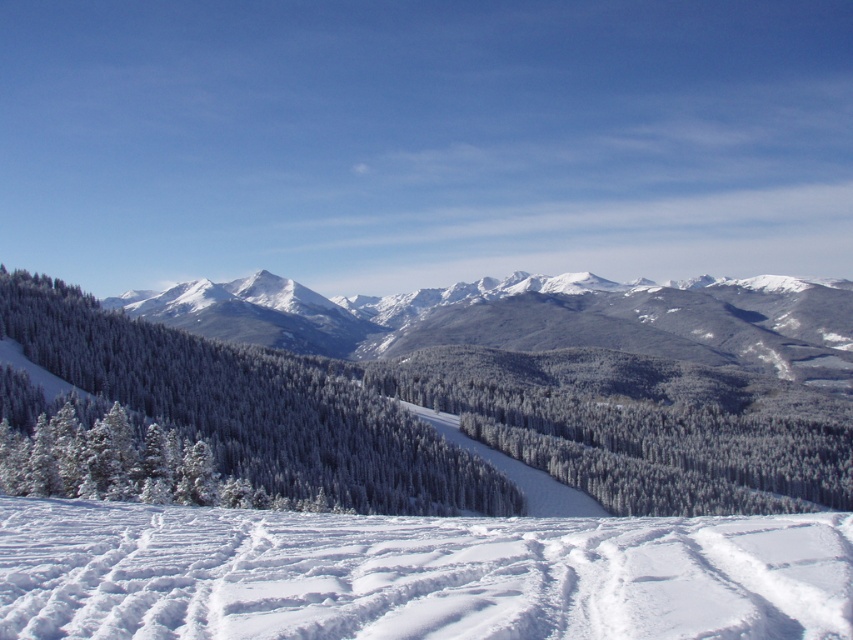
Does white snow ski slope at lower center have a smaller size compared to white frosty trees at center?

Correct, white snow ski slope at lower center occupies less space than white frosty trees at center.

Is point (425, 611) positioned after point (397, 404)?

No, it is in front of (397, 404).

I want to click on white snow ski slope at lower center, so click(415, 573).

Between white snow ski slope at lower center and snowy rocky mountain at center, which one appears on the left side from the viewer's perspective?

Positioned to the left is white snow ski slope at lower center.

Is point (231, 540) farther from viewer compared to point (300, 305)?

No, (231, 540) is closer to viewer.

Find the location of a particular element. This screenshot has height=640, width=853. white snow ski slope at lower center is located at coordinates (415, 573).

Based on the photo, which of these two, snowy rocky mountain at center or white frosty trees at center, stands shorter?

white frosty trees at center is shorter.

Between snowy rocky mountain at center and white frosty trees at center, which one is positioned lower?

white frosty trees at center is below.

At what (x,y) coordinates should I click in order to perform the action: click on snowy rocky mountain at center. Please return your answer as a coordinate pair (x, y). The image size is (853, 640). Looking at the image, I should click on (535, 317).